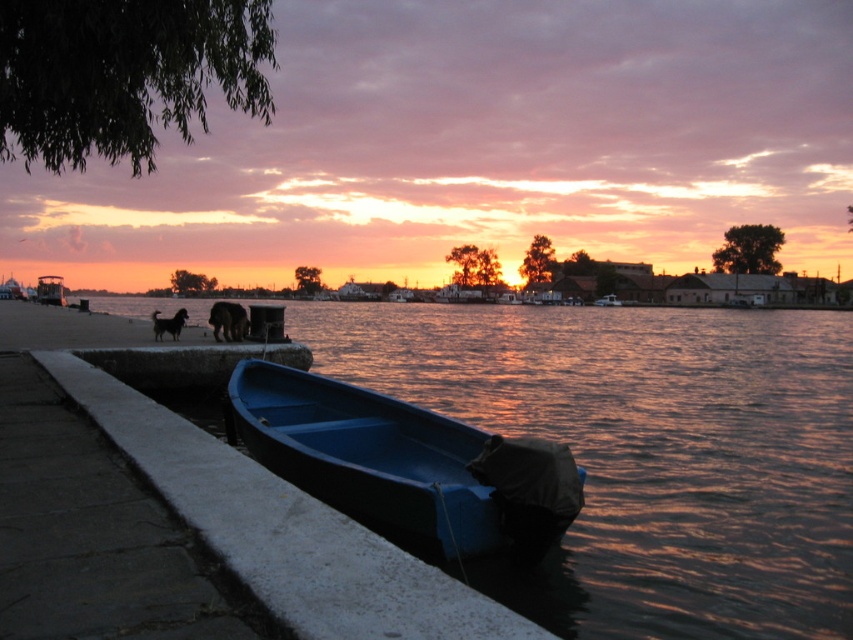
Question: Which point is farther to the camera?

Choices:
 (A) (506, 474)
 (B) (170, 426)

Answer: (B)

Question: Can you confirm if smooth concrete ledge at lower left is positioned below blue plastic canoe at lower left?

Choices:
 (A) no
 (B) yes

Answer: (A)

Question: Which of the following is the farthest from the observer?

Choices:
 (A) smooth concrete ledge at lower left
 (B) blue plastic canoe at lower left

Answer: (B)

Question: Does smooth concrete ledge at lower left appear under blue plastic canoe at lower left?

Choices:
 (A) yes
 (B) no

Answer: (B)

Question: Which object is farther from the camera taking this photo?

Choices:
 (A) smooth concrete ledge at lower left
 (B) blue plastic canoe at lower left

Answer: (B)

Question: Is smooth concrete ledge at lower left positioned at the back of blue plastic canoe at lower left?

Choices:
 (A) no
 (B) yes

Answer: (A)